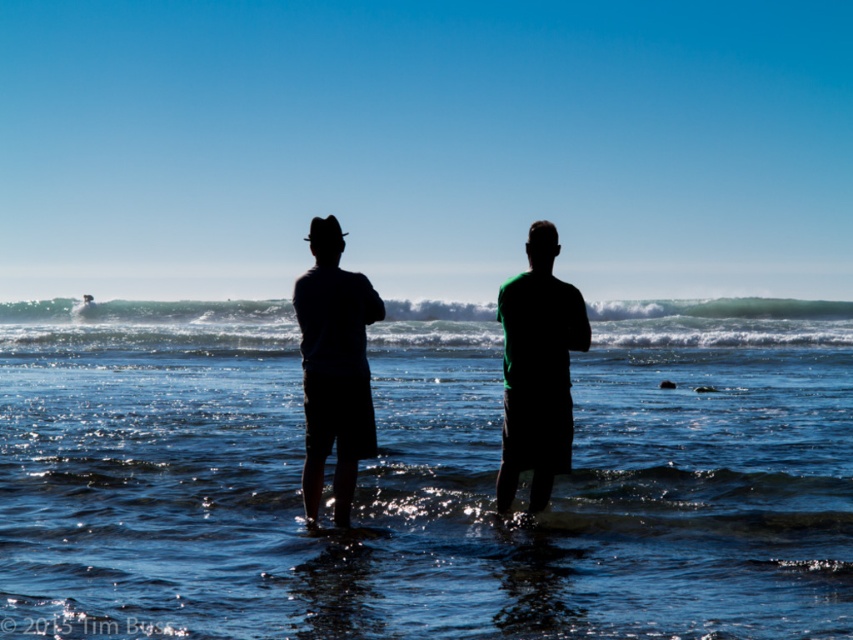
Is blue liquid water at center bigger than green matte shirt at center?

Indeed, blue liquid water at center has a larger size compared to green matte shirt at center.

Which is more to the left, blue liquid water at center or green matte shirt at center?

green matte shirt at center is more to the left.

Is point (294, 614) behind point (508, 282)?

That is False.

Find the location of `blue liquid water at center`. blue liquid water at center is located at coordinates [424, 477].

How distant is silhouette clothing at center from green matte shirt at center?

4.32 feet

In the scene shown: Can you confirm if silhouette clothing at center is thinner than green matte shirt at center?

Indeed, silhouette clothing at center has a lesser width compared to green matte shirt at center.

Describe the element at coordinates (334, 369) in the screenshot. I see `silhouette clothing at center` at that location.

Where is `silhouette clothing at center`? silhouette clothing at center is located at coordinates (334, 369).

Consider the image. Who is taller, blue liquid water at center or black matte shorts at center?

Standing taller between the two is blue liquid water at center.

Does blue liquid water at center have a greater height compared to black matte shorts at center?

Indeed, blue liquid water at center has a greater height compared to black matte shorts at center.

In order to click on blue liquid water at center in this screenshot , I will do tap(424, 477).

Find the location of `blue liquid water at center`. blue liquid water at center is located at coordinates pyautogui.click(x=424, y=477).